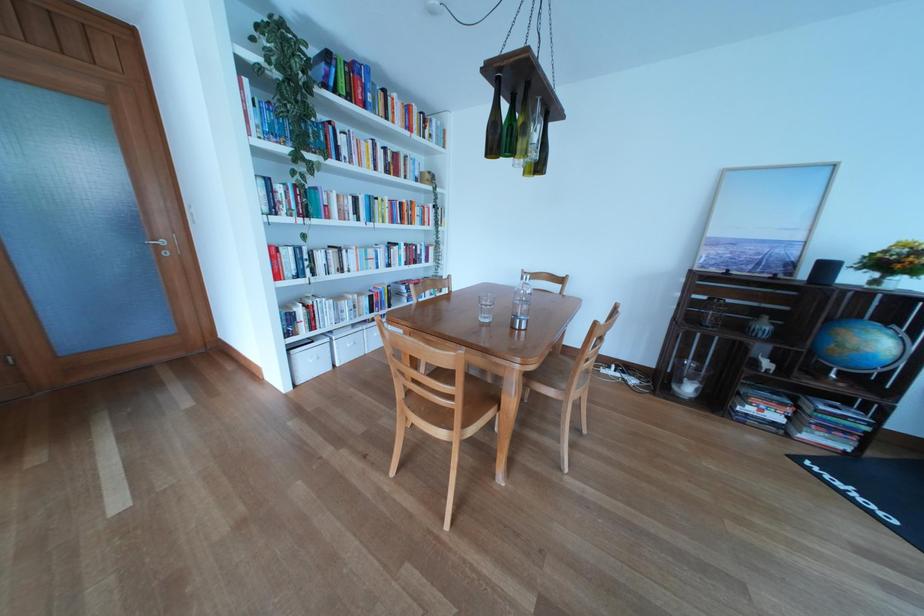
Describe the element at coordinates (161, 244) in the screenshot. I see `a silver door handle` at that location.